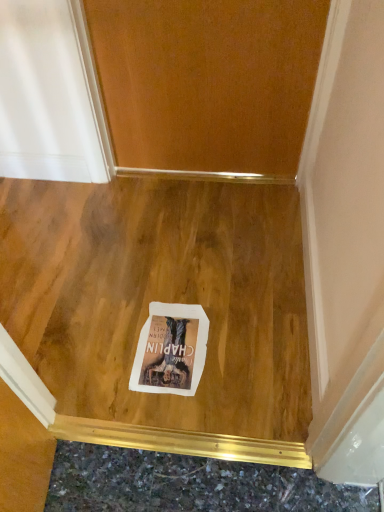
Question: Does white paper postcard at center turn towards wooden door at center?

Choices:
 (A) yes
 (B) no

Answer: (B)

Question: Is white paper postcard at center oriented away from wooden door at center?

Choices:
 (A) no
 (B) yes

Answer: (A)

Question: Does white paper postcard at center have a greater width compared to wooden door at center?

Choices:
 (A) yes
 (B) no

Answer: (A)

Question: From the image's perspective, is white paper postcard at center below wooden door at center?

Choices:
 (A) no
 (B) yes

Answer: (B)

Question: From a real-world perspective, is white paper postcard at center physically below wooden door at center?

Choices:
 (A) yes
 (B) no

Answer: (A)

Question: Is white paper postcard at center positioned before wooden door at center?

Choices:
 (A) yes
 (B) no

Answer: (A)

Question: From the image's perspective, does wooden floor at center appear lower than white paper postcard at center?

Choices:
 (A) yes
 (B) no

Answer: (B)

Question: Can you confirm if wooden floor at center is taller than white paper postcard at center?

Choices:
 (A) yes
 (B) no

Answer: (A)

Question: Is wooden floor at center outside of white paper postcard at center?

Choices:
 (A) no
 (B) yes

Answer: (B)

Question: Does wooden floor at center have a larger size compared to white paper postcard at center?

Choices:
 (A) yes
 (B) no

Answer: (A)

Question: Is wooden floor at center aimed at white paper postcard at center?

Choices:
 (A) no
 (B) yes

Answer: (A)

Question: From a real-world perspective, is wooden floor at center on white paper postcard at center?

Choices:
 (A) yes
 (B) no

Answer: (A)

Question: Is wooden door at center positioned before white paper postcard at center?

Choices:
 (A) no
 (B) yes

Answer: (A)